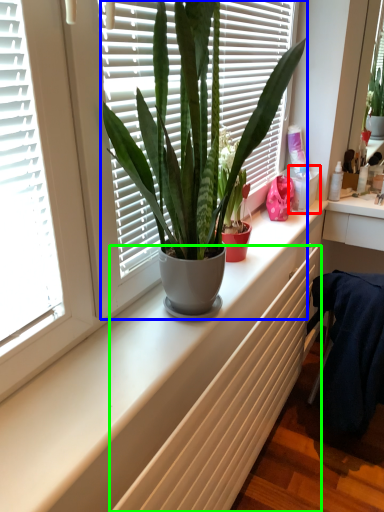
Question: Estimate the real-world distances between objects in this image. Which object is closer to window box (highlighted by a red box), houseplant (highlighted by a blue box) or radiator (highlighted by a green box)?

Choices:
 (A) houseplant
 (B) radiator

Answer: (B)